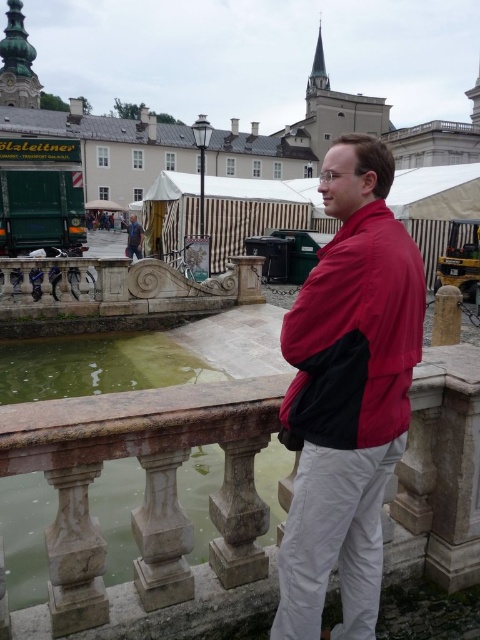
From the picture: Which is below, red matte shirt at center or blue denim jeans at lower left?

red matte shirt at center is below.

Which is in front, point (357, 404) or point (127, 243)?

Positioned in front is point (357, 404).

You are a GUI agent. You are given a task and a screenshot of the screen. Output one action in this format:
    pyautogui.click(x=<x>, y=<y>)
    Task: Click on the red matte shirt at center
    The width and height of the screenshot is (480, 640).
    Given the screenshot: What is the action you would take?
    tap(348, 394)

This screenshot has height=640, width=480. What are the coordinates of `red matte shirt at center` in the screenshot? It's located at (348, 394).

Where is `red matte shirt at center`? The width and height of the screenshot is (480, 640). red matte shirt at center is located at coordinates (348, 394).

Between red matte shirt at center and red matte jacket at center, which one appears on the right side from the viewer's perspective?

Positioned to the right is red matte shirt at center.

Is point (357, 248) positioned in front of point (370, 310)?

No, it is behind (370, 310).

Identify the location of red matte shirt at center. (348, 394).

Can you confirm if red matte shirt at center is shorter than green stone water at lower left?

Incorrect, red matte shirt at center's height does not fall short of green stone water at lower left's.

Is red matte shirt at center thinner than green stone water at lower left?

Indeed, red matte shirt at center has a lesser width compared to green stone water at lower left.

Which is in front, point (294, 403) or point (204, 512)?

Point (294, 403) is in front.

Image resolution: width=480 pixels, height=640 pixels. I want to click on red matte shirt at center, so click(x=348, y=394).